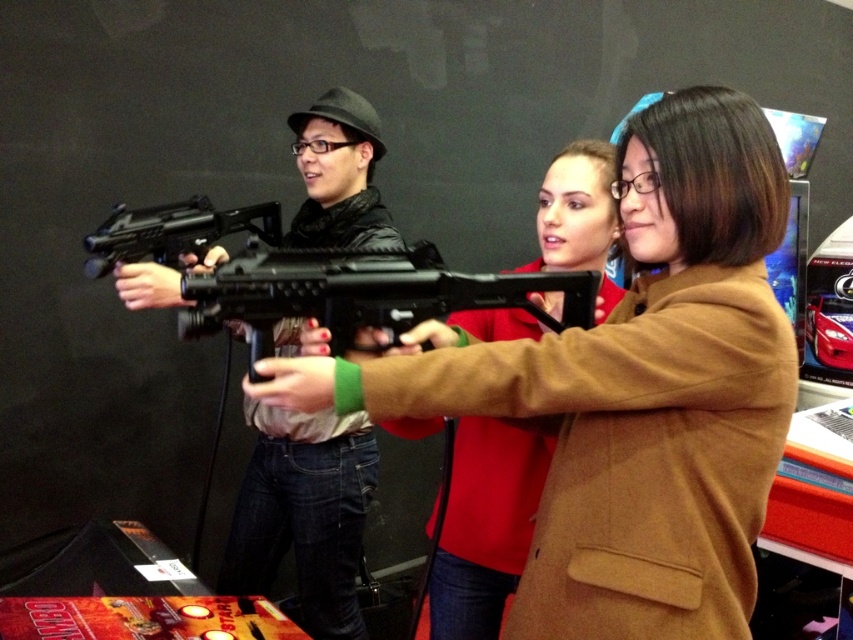
Question: Is brown woolen coat at center to the left of black plastic rifle at center from the viewer's perspective?

Choices:
 (A) no
 (B) yes

Answer: (A)

Question: Which object is farther from the camera taking this photo?

Choices:
 (A) matte black gun at center
 (B) black plastic rifle at center
 (C) black matte gun at center

Answer: (C)

Question: Can you confirm if brown woolen coat at center is positioned below black plastic rifle at center?

Choices:
 (A) yes
 (B) no

Answer: (A)

Question: Based on their relative distances, which object is nearer to the black matte gun at center?

Choices:
 (A) brown woolen coat at center
 (B) matte black gun at center
 (C) black plastic rifle at center

Answer: (B)

Question: Which is nearer to the matte black gun at center?

Choices:
 (A) black plastic rifle at center
 (B) black matte gun at center
 (C) brown woolen coat at center

Answer: (B)

Question: Is brown woolen coat at center positioned at the back of matte black gun at center?

Choices:
 (A) no
 (B) yes

Answer: (A)